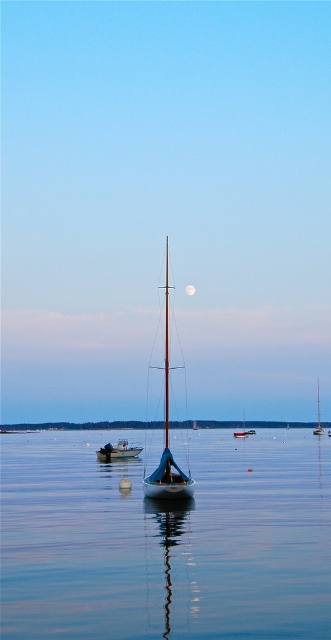
Question: Estimate the real-world distances between objects in this image. Which object is farther from the blue water at center?

Choices:
 (A) wooden sailboat at center
 (B) white plastic boat at center

Answer: (B)

Question: Where is white plastic boat at center located in relation to silvery reflective moon at upper center in the image?

Choices:
 (A) below
 (B) above

Answer: (A)

Question: Among these objects, which one is nearest to the camera?

Choices:
 (A) silvery reflective moon at upper center
 (B) smooth blue water at center

Answer: (B)

Question: Does white plastic boat at center come in front of silvery reflective moon at upper center?

Choices:
 (A) no
 (B) yes

Answer: (B)

Question: Is white plastic boat at center to the left of white sailboat at center from the viewer's perspective?

Choices:
 (A) no
 (B) yes

Answer: (B)

Question: Among these points, which one is farthest from the camera?

Choices:
 (A) (149, 422)
 (B) (172, 483)
 (C) (116, 451)
 (D) (187, 289)

Answer: (A)